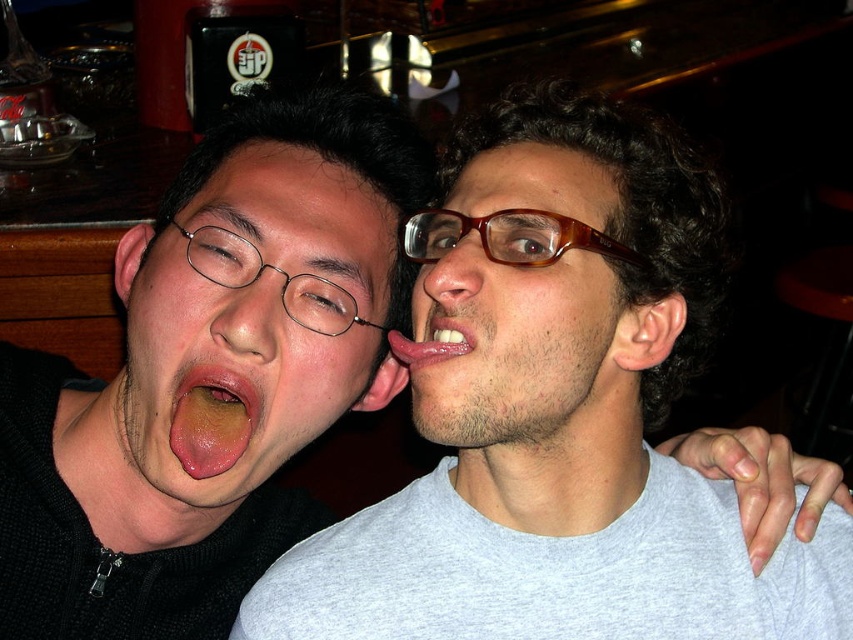
In order to click on brown glossy glasses at center in this screenshot , I will do `click(519, 307)`.

Can you confirm if brown glossy glasses at center is shorter than pink glossy tongue at center?

In fact, brown glossy glasses at center may be taller than pink glossy tongue at center.

The image size is (853, 640). I want to click on brown glossy glasses at center, so click(x=519, y=307).

Can you confirm if yellowish-green tongue at center is positioned to the left of smooth skin nose at center?

Correct, you'll find yellowish-green tongue at center to the left of smooth skin nose at center.

Between yellowish-green tongue at center and smooth skin nose at center, which one is positioned higher?

smooth skin nose at center is above.

Is point (223, 397) behind point (447, 228)?

Yes, point (223, 397) is farther from viewer.

At what (x,y) coordinates should I click in order to perform the action: click on yellowish-green tongue at center. Please return your answer as a coordinate pair (x, y). This screenshot has width=853, height=640. Looking at the image, I should click on (x=212, y=419).

Is smooth skin nose at center positioned in front of pink glossy tongue at center?

No, smooth skin nose at center is behind pink glossy tongue at center.

Which is behind, point (448, 268) or point (402, 362)?

Point (402, 362)

Locate an element on the screen. This screenshot has width=853, height=640. smooth skin nose at center is located at coordinates (447, 260).